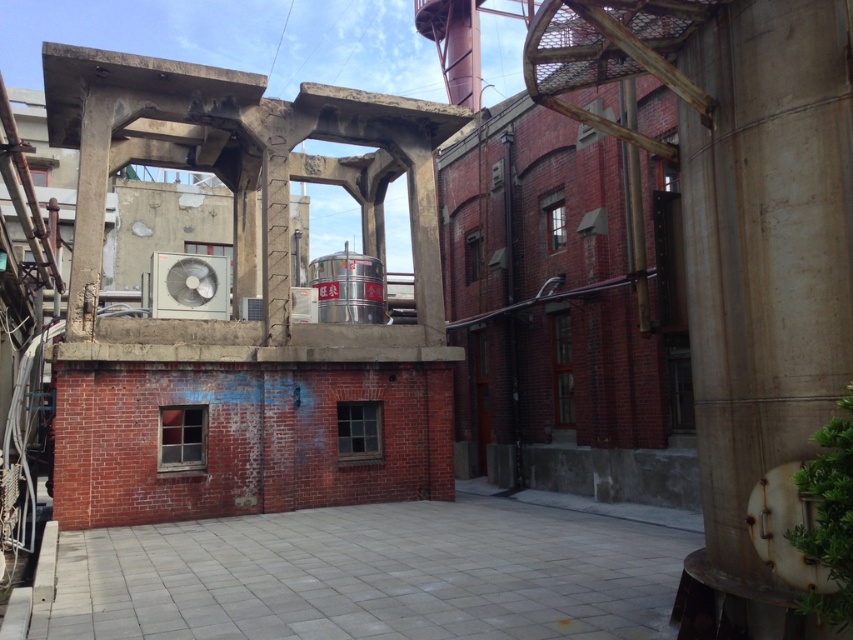
Does smooth concrete pillar at center right come behind gray concrete alley at center?

That is False.

Which of these two, smooth concrete pillar at center right or gray concrete alley at center, stands shorter?

With less height is gray concrete alley at center.

Is point (706, 332) in front of point (207, 524)?

Yes.

At what (x,y) coordinates should I click in order to perform the action: click on smooth concrete pillar at center right. Please return your answer as a coordinate pair (x, y). This screenshot has width=853, height=640. Looking at the image, I should click on point(762,289).